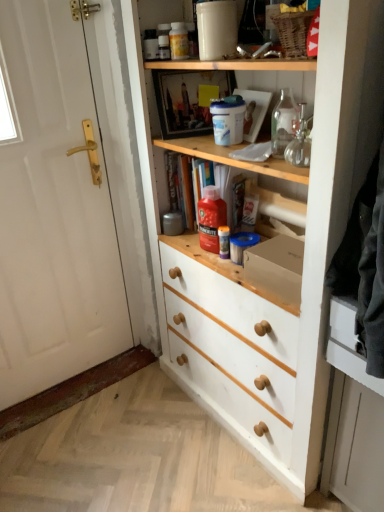
Question: Does white matte door at left have a greater height compared to transparent glass bottle at upper right?

Choices:
 (A) yes
 (B) no

Answer: (A)

Question: Is white matte door at left beside transparent glass bottle at upper right?

Choices:
 (A) yes
 (B) no

Answer: (B)

Question: Can you confirm if white matte door at left is smaller than transparent glass bottle at upper right?

Choices:
 (A) yes
 (B) no

Answer: (B)

Question: Can you confirm if white matte door at left is wider than transparent glass bottle at upper right?

Choices:
 (A) yes
 (B) no

Answer: (A)

Question: Is white matte door at left at the right side of transparent glass bottle at upper right?

Choices:
 (A) no
 (B) yes

Answer: (A)

Question: Considering the relative positions of white matte door at left and transparent glass bottle at upper right in the image provided, is white matte door at left behind transparent glass bottle at upper right?

Choices:
 (A) no
 (B) yes

Answer: (B)

Question: Is white matte door at left completely or partially inside translucent plastic bottle at upper center, marked as the 1th bottle in a top-to-bottom arrangement?

Choices:
 (A) no
 (B) yes

Answer: (A)

Question: Is translucent plastic bottle at upper center, which is counted as the 2th bottle, starting from the right, turned away from white matte door at left?

Choices:
 (A) no
 (B) yes

Answer: (A)

Question: Is translucent plastic bottle at upper center, which is counted as the 2th bottle, starting from the right, smaller than white matte door at left?

Choices:
 (A) no
 (B) yes

Answer: (B)

Question: Does translucent plastic bottle at upper center, which is counted as the 2th bottle, starting from the right, turn towards white matte door at left?

Choices:
 (A) yes
 (B) no

Answer: (B)

Question: Is translucent plastic bottle at upper center, marked as the 1th bottle in a top-to-bottom arrangement, at the left side of white matte door at left?

Choices:
 (A) no
 (B) yes

Answer: (A)

Question: Considering the relative positions of translucent plastic bottle at upper center, which is the 1th bottle from left to right, and white matte door at left in the image provided, is translucent plastic bottle at upper center, which is the 1th bottle from left to right, to the right of white matte door at left from the viewer's perspective?

Choices:
 (A) yes
 (B) no

Answer: (A)

Question: Is white matte drawer at lower right facing away from red plastic bottle at center, marked as the second bottle in a top-to-bottom arrangement?

Choices:
 (A) yes
 (B) no

Answer: (B)